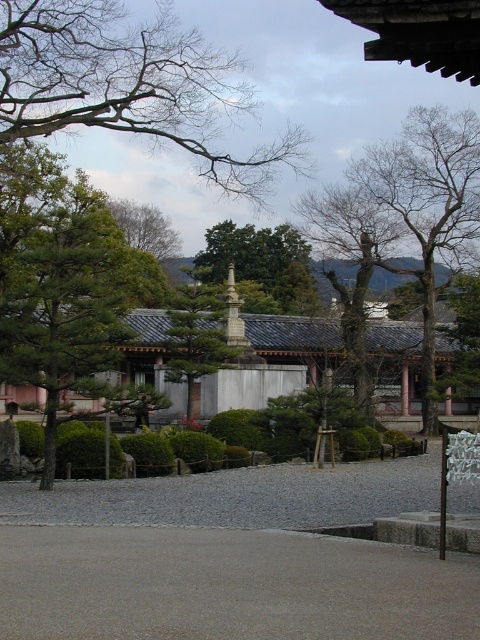
Can you confirm if bare branches at upper left is positioned above gray gravel at center?

Yes.

Consider the image. Measure the distance from bare branches at upper left to gray gravel at center.

bare branches at upper left and gray gravel at center are 21.60 meters apart.

Who is more forward, [64,56] or [374,468]?

Point [374,468]

Identify the location of bare branches at upper left. This screenshot has height=640, width=480. (131, 86).

Who is lower down, green leafy tree at center or green stone statue at center?

Positioned lower is green stone statue at center.

Is point (288, 305) farther from camera compared to point (232, 285)?

Yes, it is behind point (232, 285).

What do you see at coordinates (261, 266) in the screenshot? I see `green leafy tree at center` at bounding box center [261, 266].

The width and height of the screenshot is (480, 640). What are the coordinates of `green leafy tree at center` in the screenshot? It's located at (261, 266).

Does bare branches at upper left have a lesser width compared to bare wood tree at upper right?

No, bare branches at upper left is not thinner than bare wood tree at upper right.

Does bare branches at upper left have a lesser height compared to bare wood tree at upper right?

Yes.

The image size is (480, 640). What do you see at coordinates (131, 86) in the screenshot?
I see `bare branches at upper left` at bounding box center [131, 86].

I want to click on bare branches at upper left, so click(x=131, y=86).